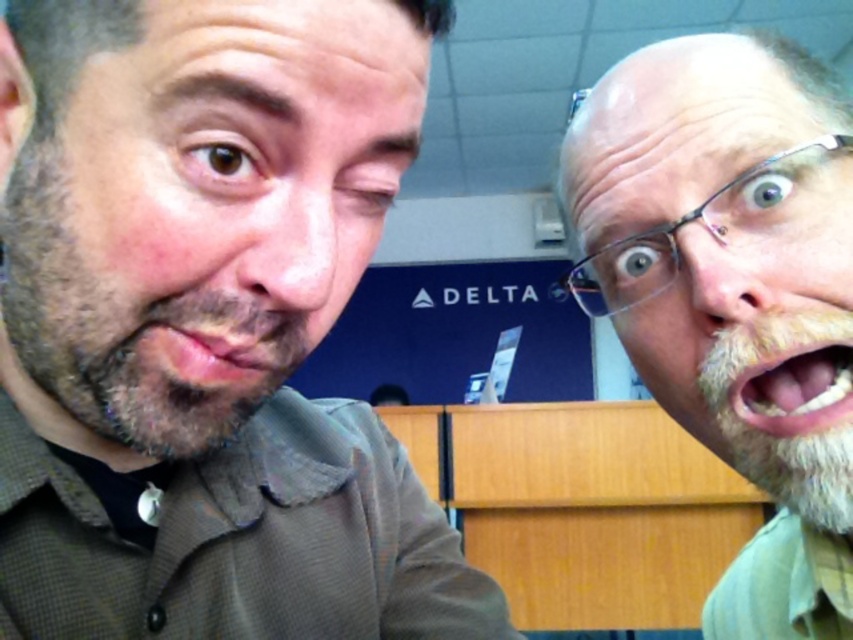
You are a photographer trying to capture a closeup of both the matte brown lips at center and the pink flesh at center in the image. Since the two subjects are positioned very close to each other, will you need to adjust your camera focus to ensure both are in focus simultaneously?

The matte brown lips at center is not as tall as pink flesh at center, so you will need to adjust your camera focus to ensure both are in focus simultaneously because their sizes differ.

You are standing in a public space and see a Delta Airlines sign on the wall. You want to reach a point that is exactly 12.12 inches away from you. Can you determine if the point at coordinates point [202,392] is the correct location?

The distance of point [202,392] from viewer is 12.12 inches, so yes, the point at coordinates point [202,392] is exactly 12.12 inches away from you.